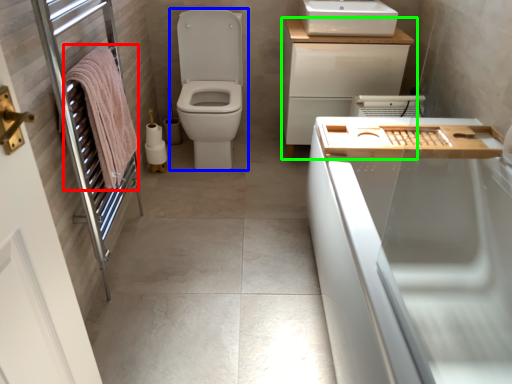
Question: Considering the real-world distances, which object is closest to bath towel (highlighted by a red box)? toilet (highlighted by a blue box) or bathroom cabinet (highlighted by a green box).

Choices:
 (A) toilet
 (B) bathroom cabinet

Answer: (A)